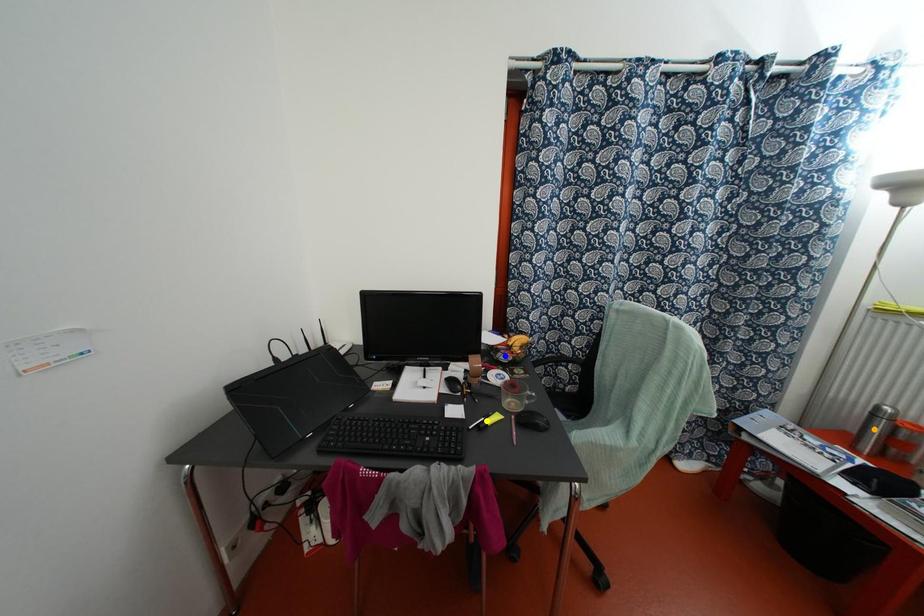
Order these from farthest to nearest:
1. yellow point
2. blue point
3. orange point

1. blue point
2. yellow point
3. orange point